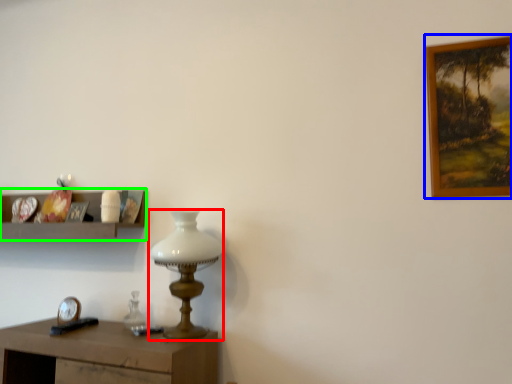
Question: Which is farther away from table lamp (highlighted by a red box)? picture frame (highlighted by a blue box) or shelf (highlighted by a green box)?

Choices:
 (A) picture frame
 (B) shelf

Answer: (A)